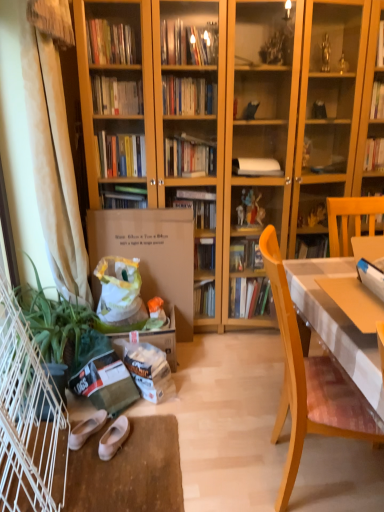
Question: Is white fabric curtain at left taller or shorter than green leafy plant at lower left?

Choices:
 (A) short
 (B) tall

Answer: (B)

Question: Is white fabric curtain at left wider or thinner than green leafy plant at lower left?

Choices:
 (A) wide
 (B) thin

Answer: (B)

Question: Estimate the real-world distances between objects in this image. Which object is closer to the brown paper bag at lower left, placed as the second paperback book when sorted from top to bottom?

Choices:
 (A) white fabric curtain at left
 (B) black plastic flowerpot at lower left
 (C) white suede shoes at lower left, marked as the 2th footwear in a right-to-left arrangement
 (D) matte cardboard box at center, placed as the 2th paperback book when sorted from bottom to top
 (E) white cloth-covered desk at right

Answer: (C)

Question: Which object is positioned farthest from the green leafy plant at lower left?

Choices:
 (A) white suede shoes at lower left, the 1th footwear in the left-to-right sequence
 (B) white cloth-covered desk at right
 (C) white fabric curtain at left
 (D) white leather shoes at lower center, acting as the first footwear starting from the right
 (E) black plastic flowerpot at lower left

Answer: (B)